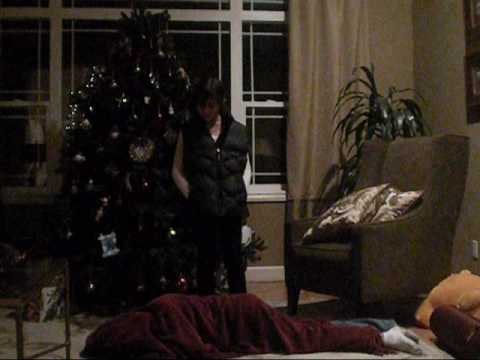
Find the location of `white baseboard`. white baseboard is located at coordinates (266, 273).